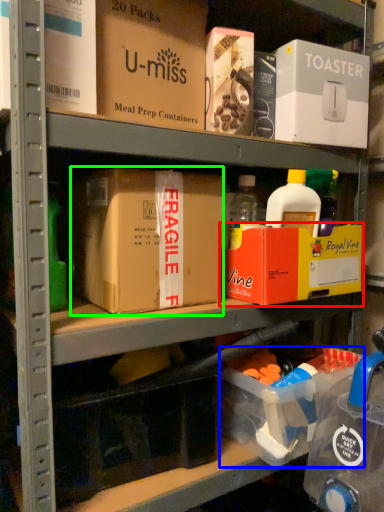
Question: Considering the real-world distances, which object is farthest from box (highlighted by a red box)? storage box (highlighted by a blue box) or box (highlighted by a green box)?

Choices:
 (A) storage box
 (B) box

Answer: (A)